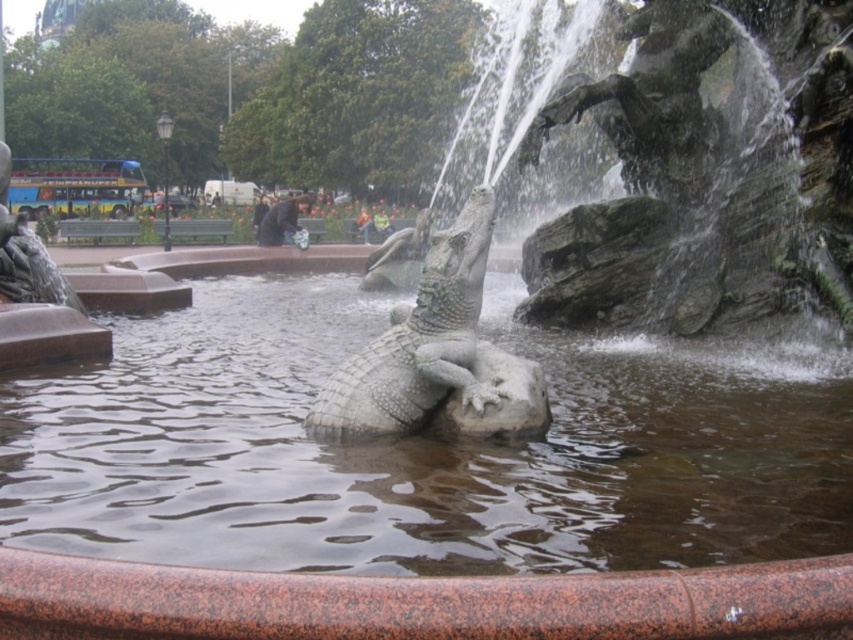
Question: Which point is closer to the camera?

Choices:
 (A) [265, 301]
 (B) [450, 268]

Answer: (B)

Question: Does smooth stone water at center appear on the left side of polished stone crocodile at center?

Choices:
 (A) no
 (B) yes

Answer: (B)

Question: Which point is farther from the camera taking this photo?

Choices:
 (A) (x=399, y=308)
 (B) (x=244, y=433)

Answer: (B)

Question: Is smooth stone water at center wider than polished stone crocodile at center?

Choices:
 (A) no
 (B) yes

Answer: (B)

Question: Is smooth stone water at center closer to camera compared to polished stone crocodile at center?

Choices:
 (A) no
 (B) yes

Answer: (B)